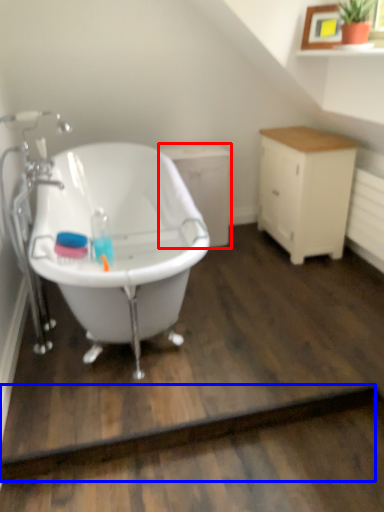
Question: Which point is further to the camera, cabinetry (highlighted by a red box) or plank (highlighted by a blue box)?

Choices:
 (A) cabinetry
 (B) plank

Answer: (A)